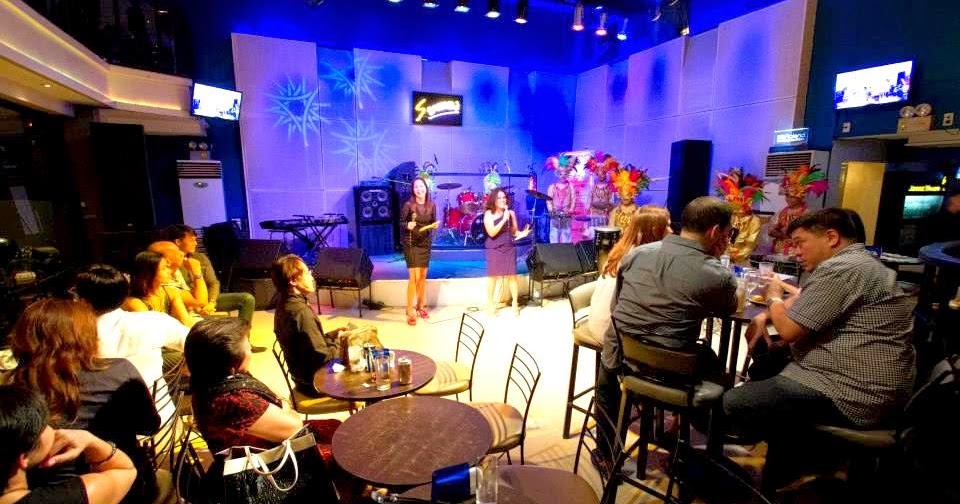
In order to click on floor in this screenshot , I will do `click(526, 331)`.